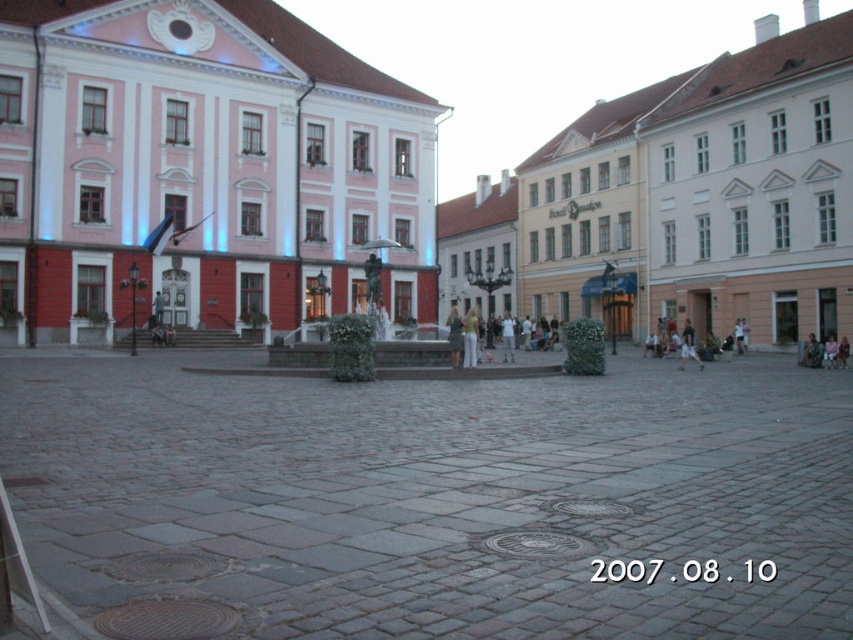
You are standing on the cobblestone plaza in the urban square and want to walk to the fountain. According to the image, where should you walk towards from your current position at point (437, 497)?

The point (437, 497) is on the gray stone pavement at center, so you should walk towards the fountain located at the center of the square.

Based on the photo, you are a city planner assessing the urban square. The pink stone building at center and the gray stone pavement at center are both key elements. Based on their spatial relationship, which one occupies more horizontal space in the image?

The pink stone building at center might be wider than gray stone pavement at center, so it likely occupies more horizontal space.